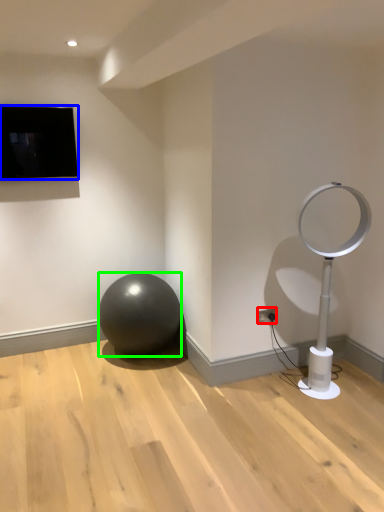
Question: Based on their relative distances, which object is farther from electric outlet (highlighted by a red box)? Choose from television (highlighted by a blue box) and ball (highlighted by a green box).

Choices:
 (A) television
 (B) ball

Answer: (A)